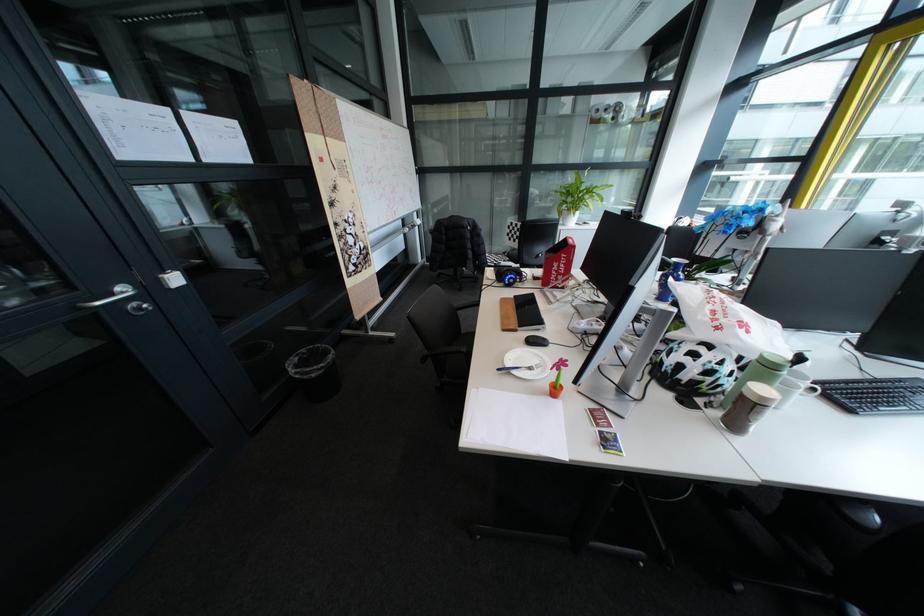
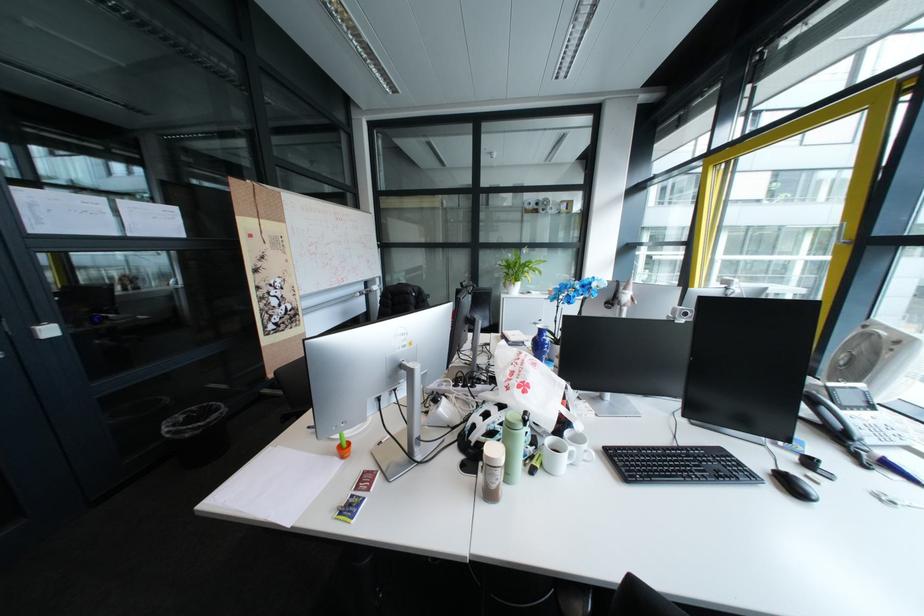
Find the pixel in the second image that matches [696,381] in the first image.

(484, 442)